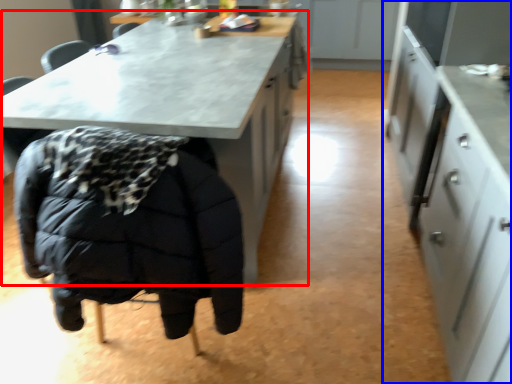
Question: Which object is closer to the camera taking this photo, table (highlighted by a red box) or cabinetry (highlighted by a blue box)?

Choices:
 (A) table
 (B) cabinetry

Answer: (B)